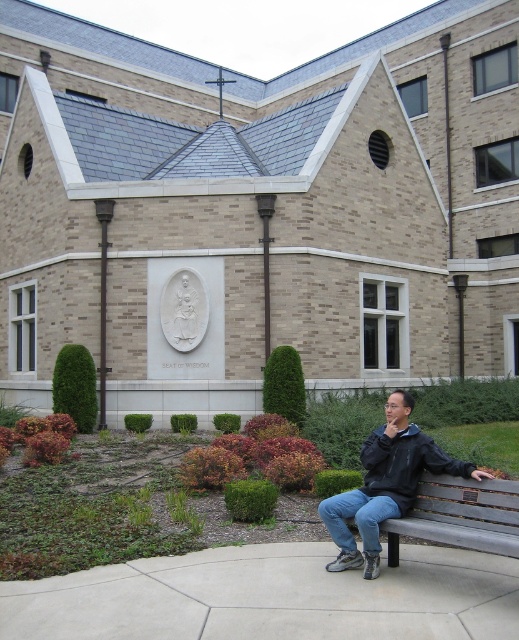
You are standing at the point with coordinates (459, 515) in the scene. What object is located exactly at this point?

The wooden bench at lower right is located exactly at point (459, 515).

You are standing in front of the brick building and notice two items at the lower right corner. Which item is positioned lower between the black matte jacket at lower right and the metallic plaque at lower right?

The black matte jacket at lower right is positioned below the metallic plaque at lower right, so it is the lower item.

You are standing at the center of the image and want to place a small potted plant exactly where the black matte jacket at lower right is currently positioned. According to the scene description, is this location feasible?

The black matte jacket at lower right is located at point (386, 484), so yes, you can place the potted plant there as the coordinates indicate an exact position where the jacket is situated.